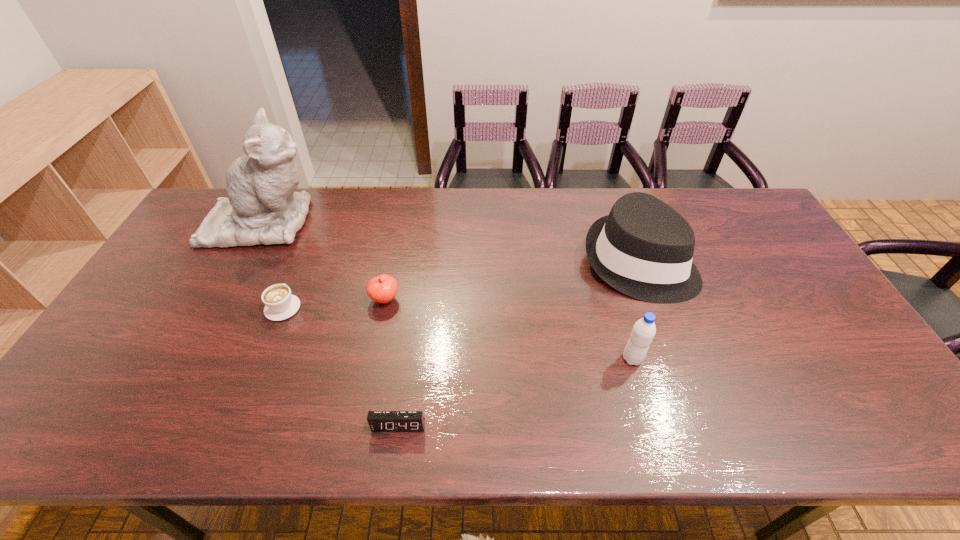
Locate an element on the screen. This screenshot has width=960, height=540. vacant space that's between the tallest object and the fedora is located at coordinates (451, 242).

You are a GUI agent. You are given a task and a screenshot of the screen. Output one action in this format:
    pyautogui.click(x=<x>, y=<y>)
    Task: Click on the unoccupied position between the alarm clock and the fedora
    Image resolution: width=960 pixels, height=540 pixels.
    Given the screenshot: What is the action you would take?
    pyautogui.click(x=518, y=344)

Choose which object is the fifth nearest neighbor to the alarm clock. Please provide its 2D coordinates. Your answer should be formatted as a tuple, i.e. [(x, y)], where the tuple contains the x and y coordinates of a point satisfying the conditions above.

[(262, 208)]

Find the location of a particular element. The width and height of the screenshot is (960, 540). object that is the closest to the water bottle is located at coordinates (644, 248).

The height and width of the screenshot is (540, 960). What are the coordinates of `free space that satisfies the following two spatial constraints: 1. on the back side of the water bottle; 2. on the front-facing side of the tallest object` in the screenshot? It's located at (594, 222).

The width and height of the screenshot is (960, 540). I want to click on vacant area in the image that satisfies the following two spatial constraints: 1. on the back side of the fifth farthest object; 2. on the front-facing side of the cat, so click(x=594, y=222).

You are a GUI agent. You are given a task and a screenshot of the screen. Output one action in this format:
    pyautogui.click(x=<x>, y=<y>)
    Task: Click on the vacant space that satisfies the following two spatial constraints: 1. on the back side of the third shortest object; 2. on the left side of the fedora
    The height and width of the screenshot is (540, 960).
    Given the screenshot: What is the action you would take?
    (x=393, y=262)

At what (x,y) coordinates should I click in order to perform the action: click on free space that satisfies the following two spatial constraints: 1. on the front-facing side of the cat; 2. on the back side of the apple. Please return your answer as a coordinate pair (x, y). This screenshot has width=960, height=540. Looking at the image, I should click on (223, 300).

This screenshot has height=540, width=960. In order to click on free space that satisfies the following two spatial constraints: 1. to the right of the cappuccino's handle; 2. on the front-facing side of the cat in this screenshot , I will do `click(317, 222)`.

In order to click on vacant space that satisfies the following two spatial constraints: 1. on the back side of the fedora; 2. on the left side of the apple in this screenshot , I will do `click(393, 262)`.